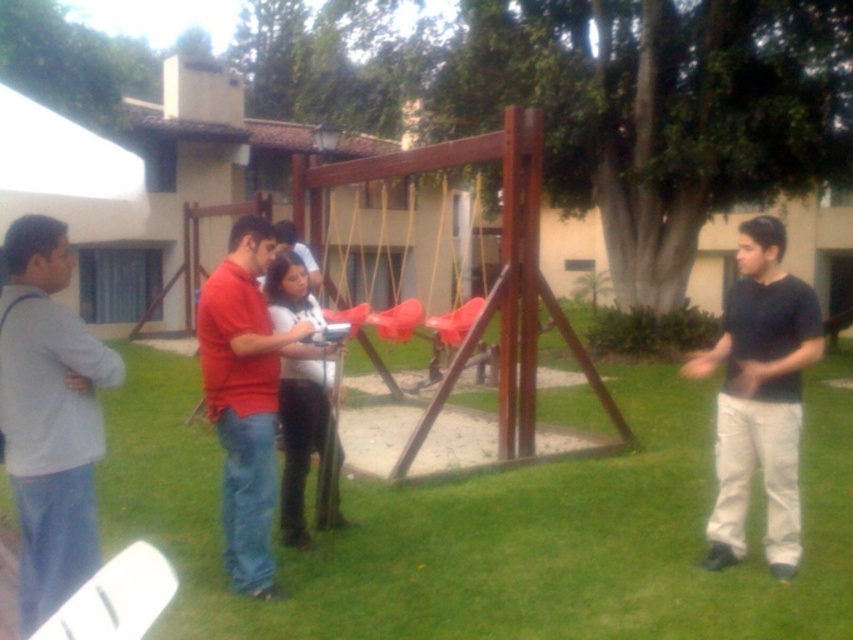
You are a photographer trying to capture a photo of the swing set. You notice two people in the scene, one wearing a black cotton shirt at right and another in a red matte shirt at center. Which person is taller and might block the view if standing closer to the swing set?

The black cotton shirt at right is taller than the red matte shirt at center, so they might block the view more if positioned closer to the swing set.

You are standing in the backyard looking at the swing set. There are two points marked on the swing set frame. Which point, point 1 at coordinates (219,378) or point 2 at (305,417), is closer to you?

Point 1 at coordinates (219,378) is closer to the viewer than point 2 at (305,417).

You are a photographer trying to capture a group photo of the people at the swing set. If you want to ensure that both the red matte shirt at center and the white matte shirt at center are fully visible in the frame, which person should you position closer to the camera to avoid being cut off?

The red matte shirt at center has a greater width than the white matte shirt at center, so positioning the red matte shirt at center closer to the camera will help ensure both are fully visible without being cut off.